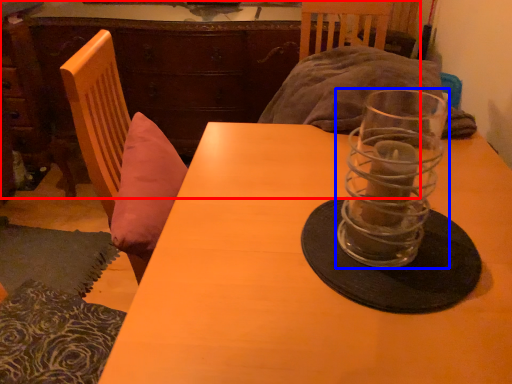
Question: Which object appears farthest to the camera in this image, dresser (highlighted by a red box) or tableware (highlighted by a blue box)?

Choices:
 (A) dresser
 (B) tableware

Answer: (A)